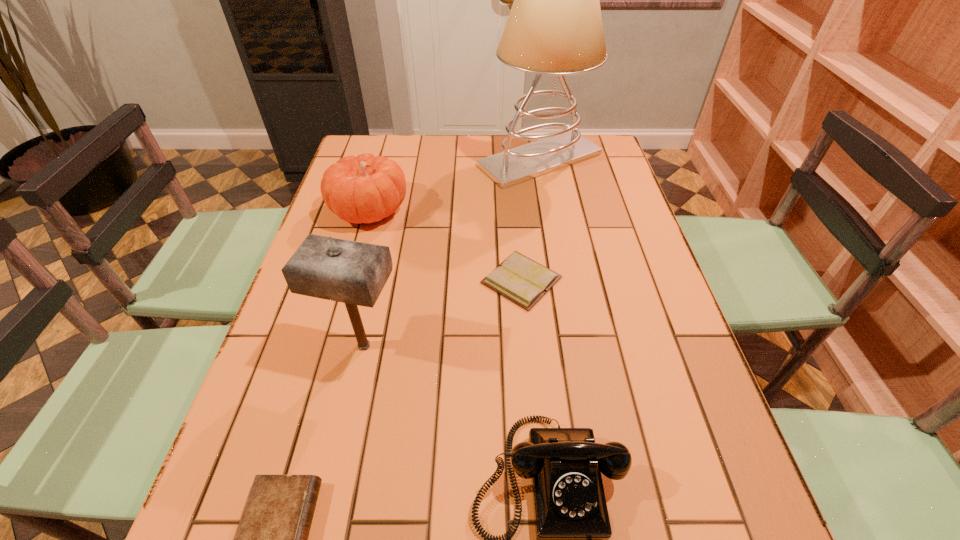
This screenshot has width=960, height=540. What are the coordinates of `unoccupied area between the pumpkin and the shortest object` in the screenshot? It's located at (445, 245).

Where is `blank region between the second tallest object and the table lamp`? The height and width of the screenshot is (540, 960). blank region between the second tallest object and the table lamp is located at coordinates [452, 253].

Find the location of a particular element. The width and height of the screenshot is (960, 540). empty location between the right diary and the tallest object is located at coordinates (531, 220).

Identify which object is the third closest to the shortest object. Please provide its 2D coordinates. Your answer should be formatted as a tuple, i.e. [(x, y)], where the tuple contains the x and y coordinates of a point satisfying the conditions above.

[(572, 525)]

Identify which object is the second nearest to the second tallest object. Please provide its 2D coordinates. Your answer should be formatted as a tuple, i.e. [(x, y)], where the tuple contains the x and y coordinates of a point satisfying the conditions above.

[(572, 525)]

I want to click on vacant region that satisfies the following two spatial constraints: 1. on the back side of the third farthest object; 2. on the left side of the mallet, so click(378, 280).

The width and height of the screenshot is (960, 540). I want to click on vacant space that satisfies the following two spatial constraints: 1. on the back side of the tallest object; 2. on the right side of the fifth shortest object, so click(x=405, y=160).